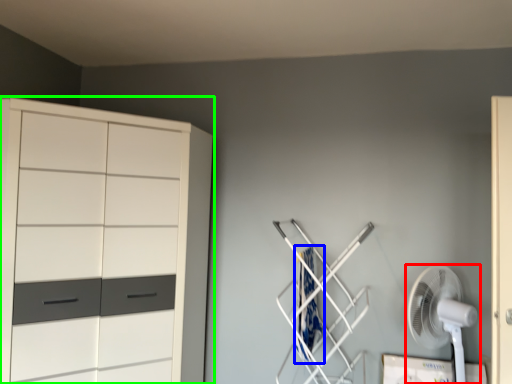
Question: Based on their relative distances, which object is nearer to mechanical fan (highlighted by a red box)? Choose from laundry (highlighted by a blue box) and cupboard (highlighted by a green box).

Choices:
 (A) laundry
 (B) cupboard

Answer: (A)